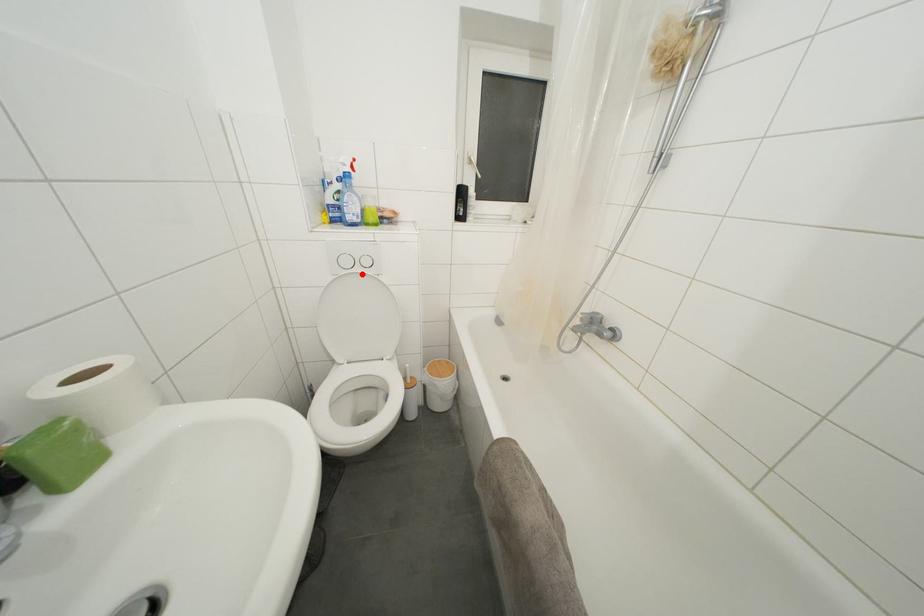
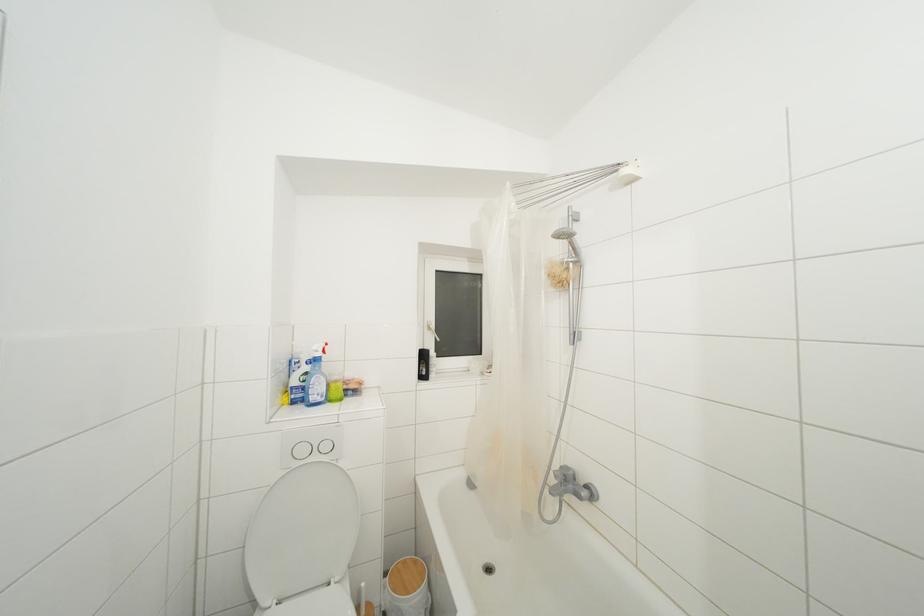
Find the pixel in the second image that matches the highlighted location in the first image.

(320, 463)